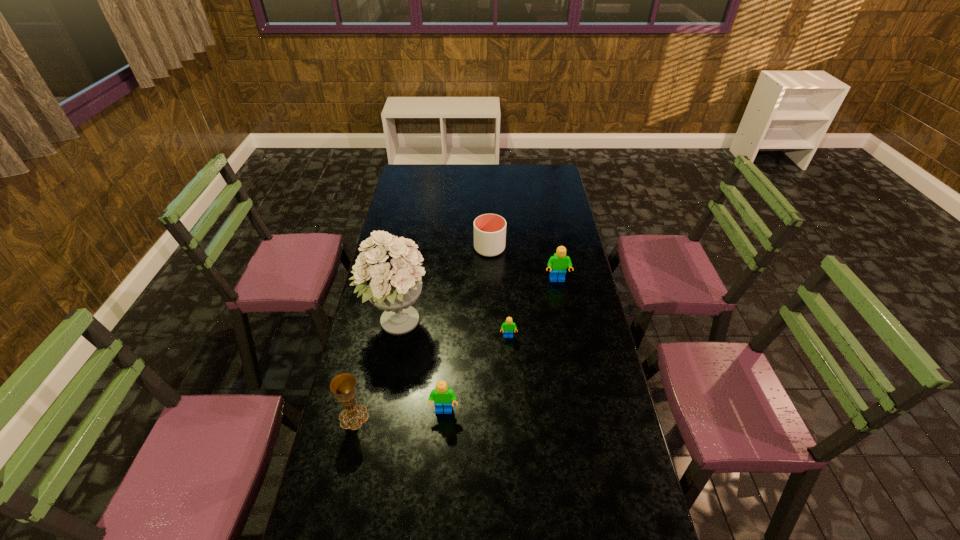
Image resolution: width=960 pixels, height=540 pixels. In order to click on vacant area between the bouquet and the chalice in this screenshot , I will do `click(375, 370)`.

This screenshot has width=960, height=540. Find the location of `unoccupied position between the second farthest Lego and the cup`. unoccupied position between the second farthest Lego and the cup is located at coordinates (499, 293).

Choose which object is the nearest neighbor to the leftmost Lego. Please provide its 2D coordinates. Your answer should be formatted as a tuple, i.e. [(x, y)], where the tuple contains the x and y coordinates of a point satisfying the conditions above.

[(343, 385)]

Choose which object is the fifth nearest neighbor to the chalice. Please provide its 2D coordinates. Your answer should be formatted as a tuple, i.e. [(x, y)], where the tuple contains the x and y coordinates of a point satisfying the conditions above.

[(558, 263)]

Locate an element on the screen. This screenshot has width=960, height=540. Lego that is the second closest to the second nearest Lego is located at coordinates (442, 395).

Select which Lego is the closest to the farthest object. Please provide its 2D coordinates. Your answer should be formatted as a tuple, i.e. [(x, y)], where the tuple contains the x and y coordinates of a point satisfying the conditions above.

[(558, 263)]

Find the location of a particular element. The image size is (960, 540). vacant region that satisfies the following two spatial constraints: 1. on the back side of the cup; 2. on the left side of the tallest object is located at coordinates pyautogui.click(x=410, y=248).